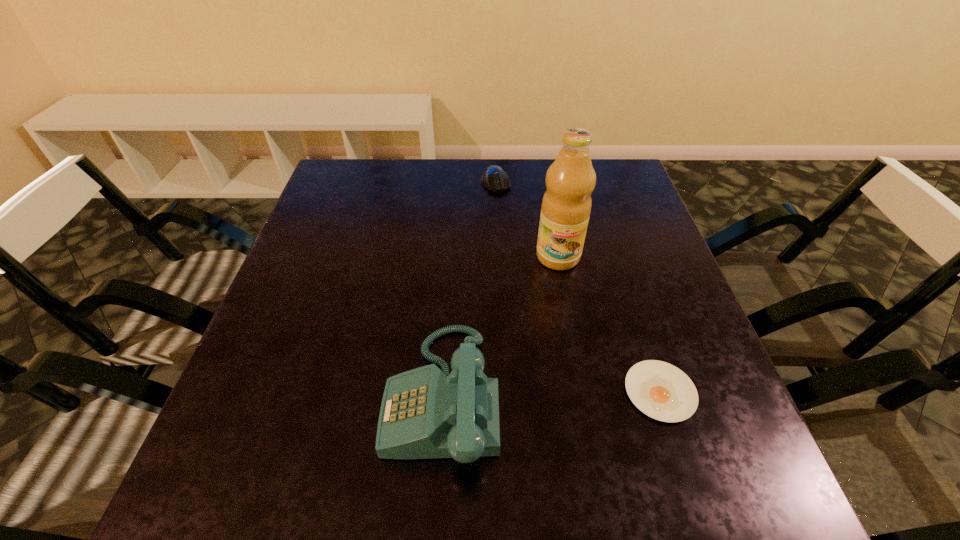
Locate an element on the screen. The width and height of the screenshot is (960, 540). object at the right edge is located at coordinates (660, 390).

Find the location of a particular element. This screenshot has height=540, width=960. object present at the near right corner is located at coordinates (660, 390).

In the image, there is a desktop. In order to click on vacant space at the far edge in this screenshot , I will do `click(477, 168)`.

Image resolution: width=960 pixels, height=540 pixels. In the image, there is a desktop. What are the coordinates of `vacant region at the near edge` in the screenshot? It's located at (636, 431).

Locate an element on the screen. The height and width of the screenshot is (540, 960). vacant space at the left edge is located at coordinates (291, 328).

You are a GUI agent. You are given a task and a screenshot of the screen. Output one action in this format:
    pyautogui.click(x=<x>, y=<y>)
    Task: Click on the vacant space at the right edge
    The image size is (960, 540).
    Given the screenshot: What is the action you would take?
    pyautogui.click(x=617, y=261)

Identify the location of vacant space at the far right corner. This screenshot has width=960, height=540. (598, 168).

The height and width of the screenshot is (540, 960). I want to click on vacant space at the near right corner of the desktop, so click(x=679, y=426).

Locate an element on the screen. This screenshot has width=960, height=540. vacant area between the shortest object and the telephone is located at coordinates (551, 393).

Locate an element on the screen. free spot between the third shortest object and the tallest object is located at coordinates (500, 326).